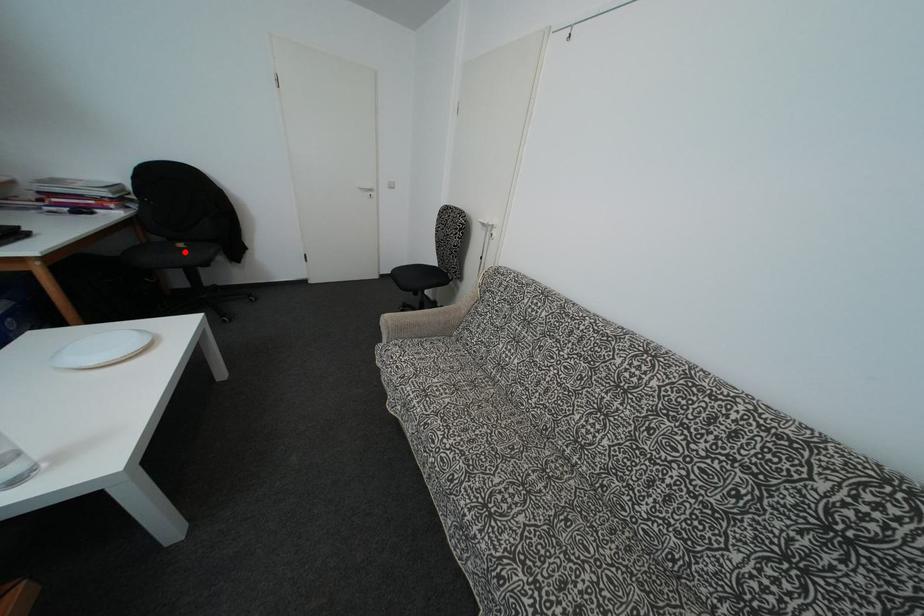
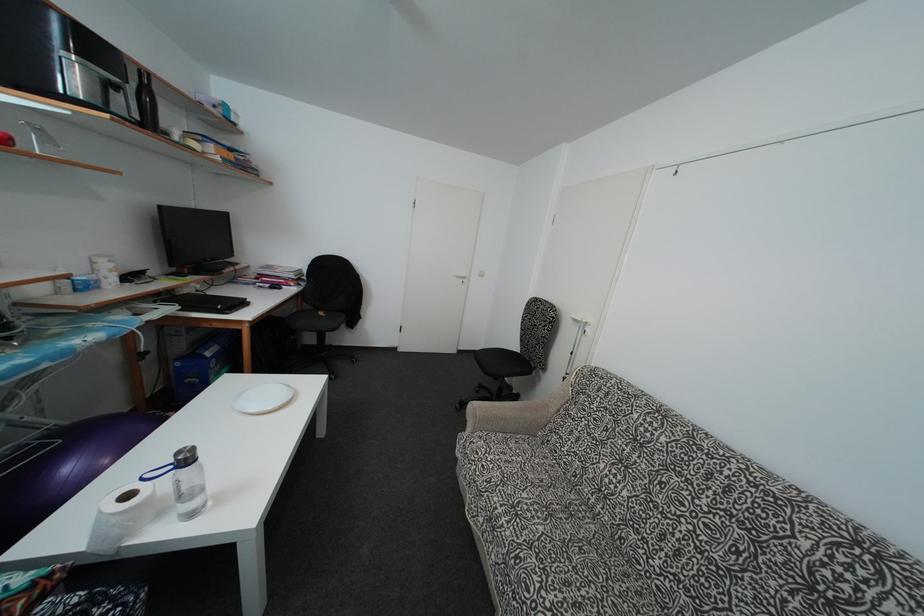
Question: I am providing you with two images of the same scene from different viewpoints. A red point is shown in image1. For the corresponding object point in image2, is it positioned nearer or farther from the camera?

Choices:
 (A) Nearer
 (B) Farther

Answer: (A)